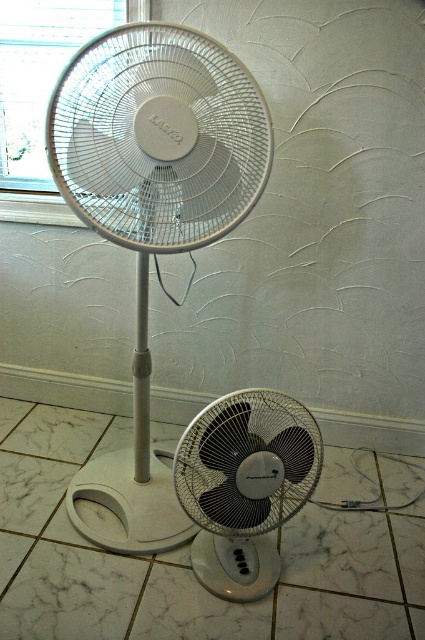
Question: Which of the following is the closest to the observer?

Choices:
 (A) black plastic fan at lower center
 (B) white plastic mechanical fan at upper center

Answer: (B)

Question: Is white plastic mechanical fan at upper center thinner than black plastic fan at lower center?

Choices:
 (A) no
 (B) yes

Answer: (A)

Question: Does white plastic mechanical fan at upper center appear on the left side of black plastic fan at lower center?

Choices:
 (A) no
 (B) yes

Answer: (B)

Question: Observing the image, what is the correct spatial positioning of white plastic mechanical fan at upper center in reference to black plastic fan at lower center?

Choices:
 (A) above
 (B) below

Answer: (A)